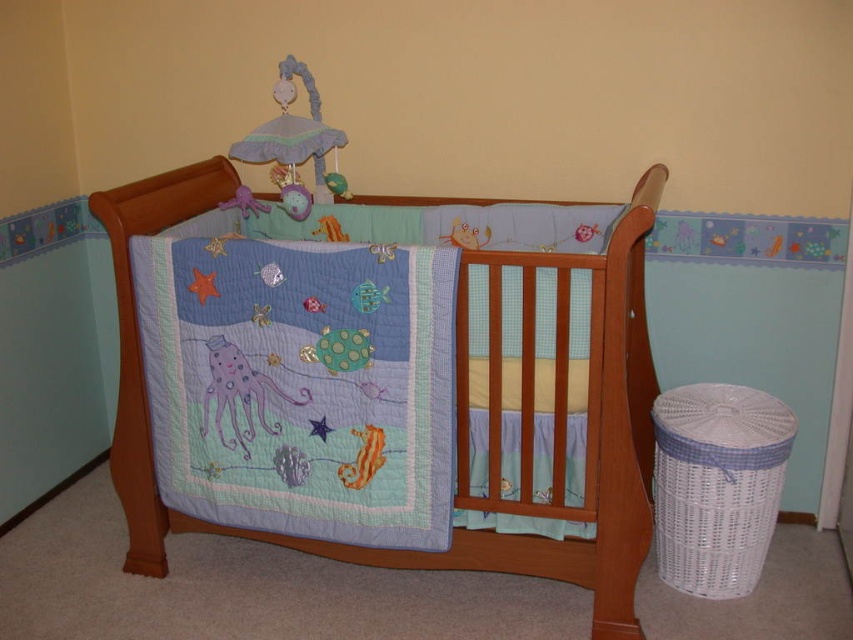
Question: Does pastel quilt at center appear on the right side of matte blue quilted crib at center?

Choices:
 (A) no
 (B) yes

Answer: (A)

Question: Which object is closer to the camera taking this photo?

Choices:
 (A) matte fabric mobile at upper center
 (B) pastel quilt at center
 (C) purple fabric octopus at center

Answer: (B)

Question: Which point is farther to the camera?

Choices:
 (A) matte fabric mobile at upper center
 (B) pastel quilt at center
 (C) matte blue quilted crib at center
 (D) purple fabric octopus at center

Answer: (A)

Question: Where is matte blue quilted crib at center located in relation to matte fabric mobile at upper center in the image?

Choices:
 (A) below
 (B) above

Answer: (A)

Question: Can you confirm if matte blue quilted crib at center is positioned above matte fabric mobile at upper center?

Choices:
 (A) yes
 (B) no

Answer: (B)

Question: Which point appears farthest from the camera in this image?

Choices:
 (A) (316, 124)
 (B) (596, 266)
 (C) (251, 371)
 (D) (318, 538)

Answer: (A)